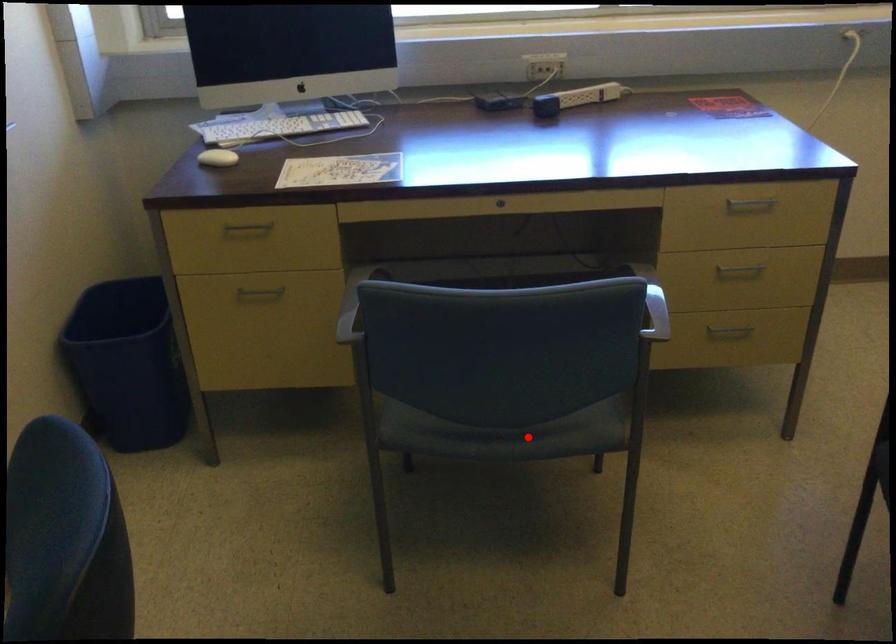
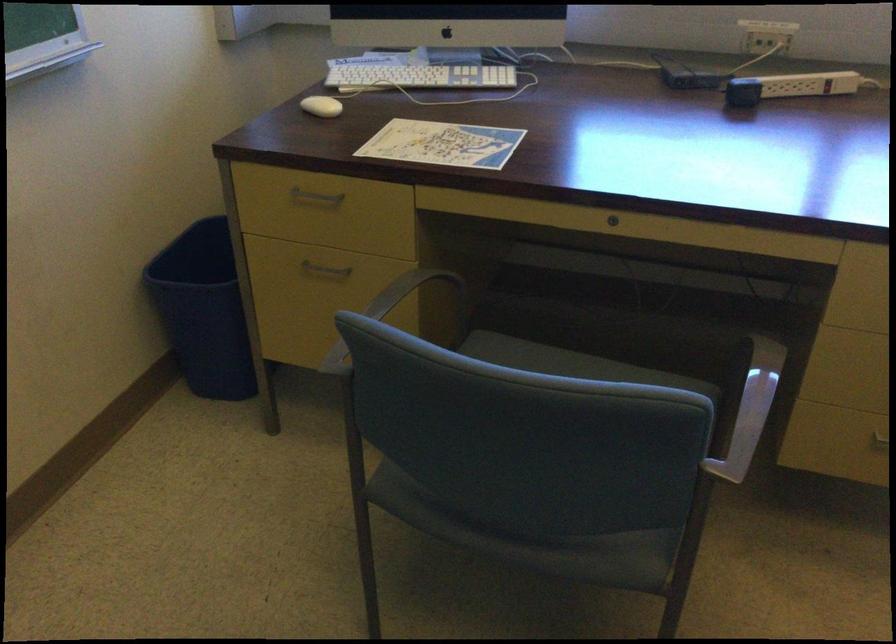
Question: I am providing you with two images of the same scene from different viewpoints. In image1, a red point is highlighted. Considering the same 3D point in image2, which of the following is correct?

Choices:
 (A) It is closer
 (B) It is farther

Answer: (A)